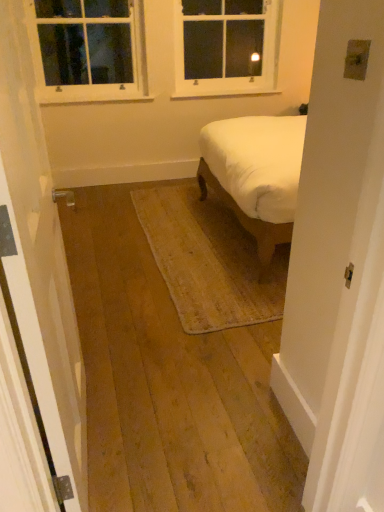
Question: From a real-world perspective, relative to white painted wood window at upper left, acting as the second window starting from the right, is white wooden door at left vertically above or below?

Choices:
 (A) below
 (B) above

Answer: (A)

Question: In the image, is white wooden door at left positioned in front of or behind white painted wood window at upper left, which appears as the first window when viewed from the left?

Choices:
 (A) front
 (B) behind

Answer: (A)

Question: Estimate the real-world distances between objects in this image. Which object is farther from the white wooden door at left?

Choices:
 (A) white painted wood window at upper left, acting as the second window starting from the right
 (B) white glass window at upper center, which is the second window from left to right

Answer: (B)

Question: Which is farther from the white glass window at upper center, which is counted as the first window, starting from the right?

Choices:
 (A) white wooden door at left
 (B) white painted wood window at upper left, acting as the second window starting from the right

Answer: (A)